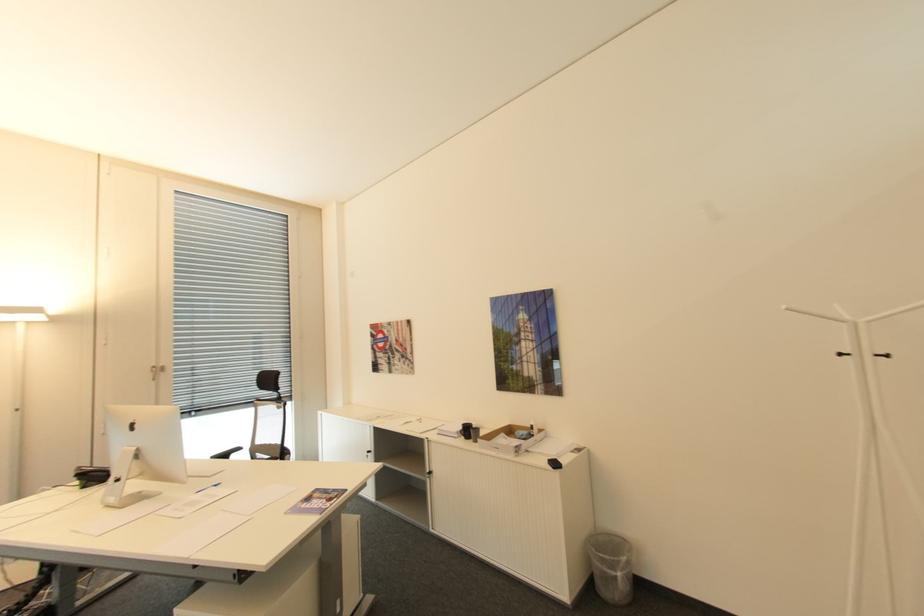
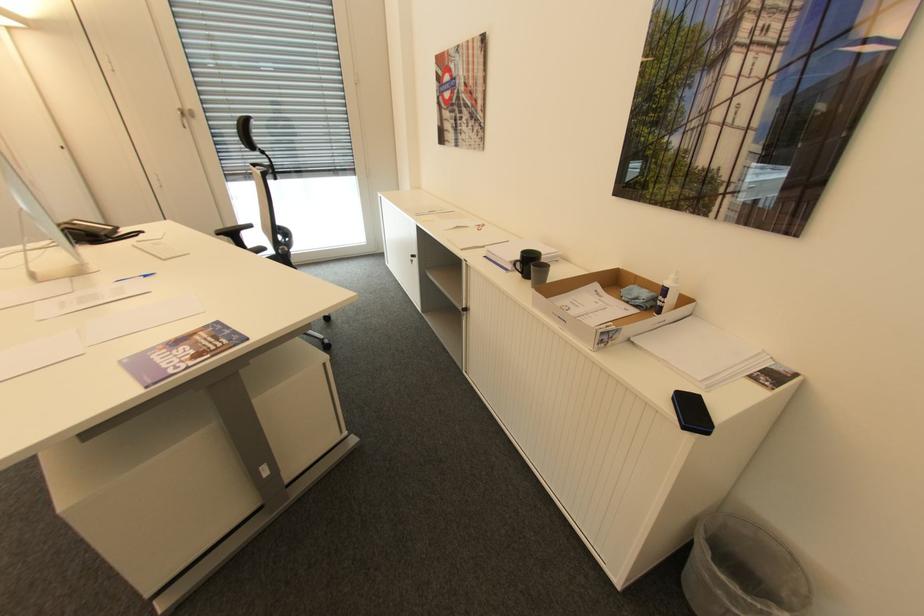
Where in the second image is the point corresponding to (x=481, y=430) from the first image?

(550, 268)